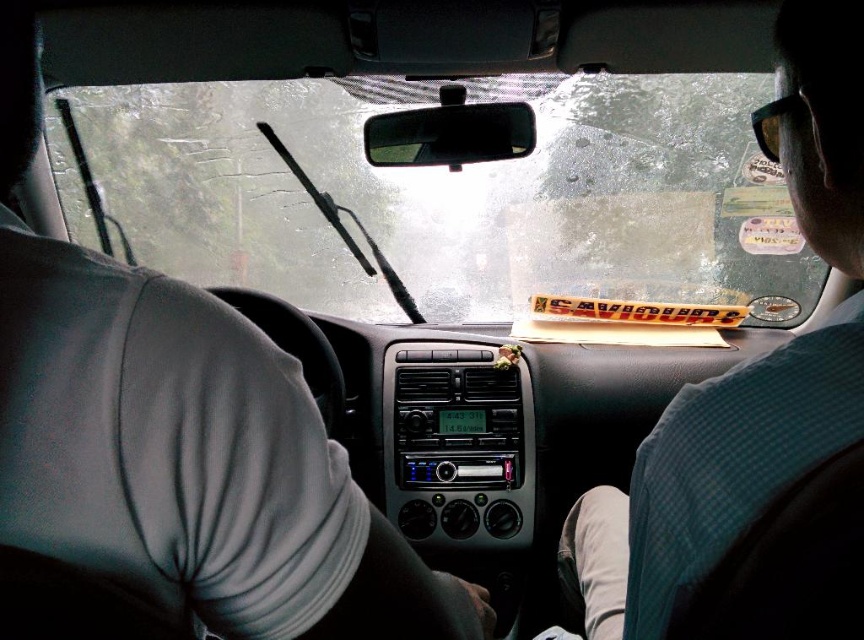
Which is in front, point (608, 120) or point (810, 61)?

Point (810, 61) is in front.

Can you confirm if transparent glass windshield at center is positioned to the right of green checkered shirt at upper right?

Incorrect, transparent glass windshield at center is not on the right side of green checkered shirt at upper right.

Between point (761, 180) and point (815, 576), which one is positioned in front?

Positioned in front is point (815, 576).

Where is `transparent glass windshield at center`? The height and width of the screenshot is (640, 864). transparent glass windshield at center is located at coordinates [x=449, y=195].